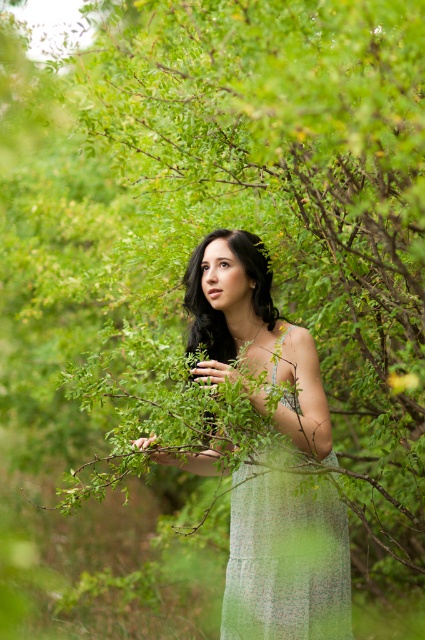
You are a photographer trying to capture the perfect shot of the light green textured dress at center and the light green sheer dress at center. Since you want to focus on the textured dress first, which dress should you position on the left side of your frame?

The light green textured dress at center is to the left of light green sheer dress at center, so you should position the light green textured dress at center on the left side of your frame to focus on it first.